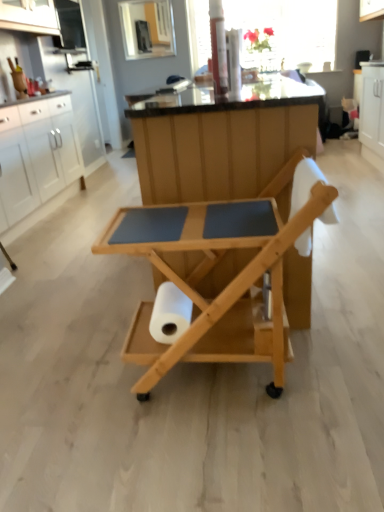
Question: Does white matte paper towel at center have a greater height compared to transparent glass window screen at upper center?

Choices:
 (A) no
 (B) yes

Answer: (A)

Question: Is white matte paper towel at center smaller than transparent glass window screen at upper center?

Choices:
 (A) yes
 (B) no

Answer: (A)

Question: Does white matte paper towel at center contain transparent glass window screen at upper center?

Choices:
 (A) yes
 (B) no

Answer: (B)

Question: Is white matte paper towel at center positioned beyond the bounds of transparent glass window screen at upper center?

Choices:
 (A) yes
 (B) no

Answer: (A)

Question: Is white matte paper towel at center far away from transparent glass window screen at upper center?

Choices:
 (A) no
 (B) yes

Answer: (B)

Question: Considering the positions of transparent glass window screen at upper center and white matte paper towel at center in the image, is transparent glass window screen at upper center wider or thinner than white matte paper towel at center?

Choices:
 (A) wide
 (B) thin

Answer: (A)

Question: In the image, is transparent glass window screen at upper center positioned in front of or behind white matte paper towel at center?

Choices:
 (A) front
 (B) behind

Answer: (B)

Question: Based on their positions, is transparent glass window screen at upper center located to the left or right of white matte paper towel at center?

Choices:
 (A) right
 (B) left

Answer: (A)

Question: Considering the positions of transparent glass window screen at upper center and white matte paper towel at center in the image, is transparent glass window screen at upper center taller or shorter than white matte paper towel at center?

Choices:
 (A) tall
 (B) short

Answer: (A)

Question: Considering the positions of natural wood rolling cart at center and transparent glass window screen at upper center in the image, is natural wood rolling cart at center taller or shorter than transparent glass window screen at upper center?

Choices:
 (A) short
 (B) tall

Answer: (A)

Question: Is point [135, 330] positioned closer to the camera than point [196, 39]?

Choices:
 (A) farther
 (B) closer

Answer: (B)

Question: In terms of width, does natural wood rolling cart at center look wider or thinner when compared to transparent glass window screen at upper center?

Choices:
 (A) wide
 (B) thin

Answer: (A)

Question: Based on their sizes in the image, would you say natural wood rolling cart at center is bigger or smaller than transparent glass window screen at upper center?

Choices:
 (A) big
 (B) small

Answer: (B)

Question: In terms of size, does white matte paper towel at center appear bigger or smaller than natural wood rolling cart at center?

Choices:
 (A) small
 (B) big

Answer: (A)

Question: Is point (190, 311) positioned closer to the camera than point (165, 365)?

Choices:
 (A) farther
 (B) closer

Answer: (A)